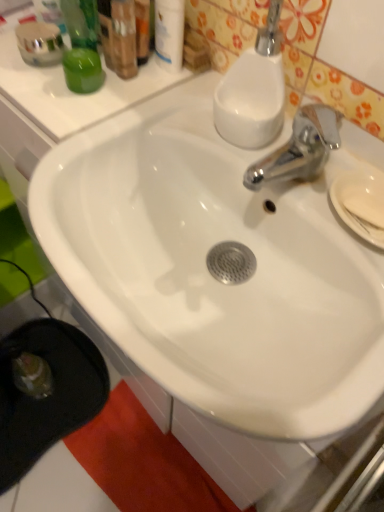
Find the location of a particular element. Image resolution: width=384 pixels, height=512 pixels. free space on the front side of white glossy lotion at upper center is located at coordinates (158, 118).